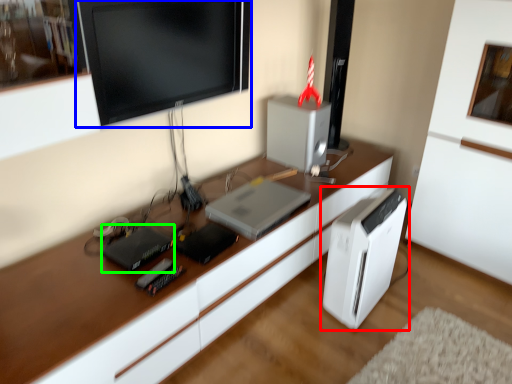
Question: Which object is the farthest from home appliance (highlighted by a red box)? Choose among these: computer monitor (highlighted by a blue box) or appliance (highlighted by a green box).

Choices:
 (A) computer monitor
 (B) appliance

Answer: (A)